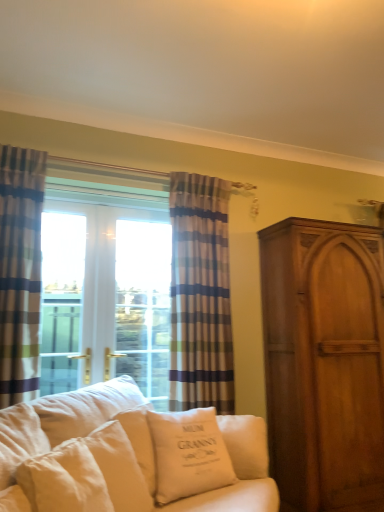
The image size is (384, 512). I want to click on striped fabric curtain at center, which is counted as the second curtain, starting from the left, so click(x=200, y=295).

The width and height of the screenshot is (384, 512). Find the location of `matte wood cabinet at right`. matte wood cabinet at right is located at coordinates (324, 362).

This screenshot has height=512, width=384. Describe the element at coordinates (324, 362) in the screenshot. I see `matte wood cabinet at right` at that location.

The image size is (384, 512). What do you see at coordinates (119, 467) in the screenshot? I see `white cotton pillow at center, placed as the second pillow when sorted from right to left` at bounding box center [119, 467].

This screenshot has height=512, width=384. I want to click on striped fabric curtain at left, positioned as the 1th curtain in left-to-right order, so click(x=20, y=271).

This screenshot has height=512, width=384. Identify the location of striped fabric curtain at center, the 1th curtain in the back-to-front sequence. pyautogui.click(x=200, y=295).

Considering the relative positions of white cotton cushion at center, arranged as the first pillow when viewed from the right, and white cotton pillow at center, marked as the 1th pillow in a left-to-right arrangement, in the image provided, is white cotton cushion at center, arranged as the first pillow when viewed from the right, to the left or to the right of white cotton pillow at center, marked as the 1th pillow in a left-to-right arrangement,?

Clearly, white cotton cushion at center, arranged as the first pillow when viewed from the right, is on the right of white cotton pillow at center, marked as the 1th pillow in a left-to-right arrangement, in the image.

What's the angular difference between white cotton cushion at center, acting as the 2th pillow starting from the left, and white cotton pillow at center, marked as the 1th pillow in a left-to-right arrangement,'s facing directions?

They differ by 26.2 degrees in their facing directions.

Which is in front, white cotton cushion at center, arranged as the first pillow when viewed from the right, or white cotton pillow at center, marked as the 1th pillow in a left-to-right arrangement?

white cotton pillow at center, marked as the 1th pillow in a left-to-right arrangement, is in front.

Considering the sizes of objects white cotton cushion at center, arranged as the first pillow when viewed from the right, and white cotton pillow at center, placed as the second pillow when sorted from right to left, in the image provided, who is taller, white cotton cushion at center, arranged as the first pillow when viewed from the right, or white cotton pillow at center, placed as the second pillow when sorted from right to left,?

With more height is white cotton cushion at center, arranged as the first pillow when viewed from the right.

In the scene shown: Which point is more forward, (245, 469) or (232, 393)?

The point (245, 469) is closer to the camera.

Which is more to the left, white fabric couch at lower left or striped fabric curtain at center, the first curtain positioned from the right?

Positioned to the left is white fabric couch at lower left.

Is white fabric couch at lower left next to striped fabric curtain at center, which is counted as the second curtain, starting from the left?

No.

In the scene shown: Considering the relative sizes of white fabric couch at lower left and striped fabric curtain at center, the first curtain positioned from the right, in the image provided, is white fabric couch at lower left taller than striped fabric curtain at center, the first curtain positioned from the right,?

Incorrect, the height of white fabric couch at lower left is not larger of that of striped fabric curtain at center, the first curtain positioned from the right.

Considering the relative sizes of striped fabric curtain at center, the 1th curtain in the back-to-front sequence, and striped fabric curtain at left, marked as the first curtain in a front-to-back arrangement, in the image provided, is striped fabric curtain at center, the 1th curtain in the back-to-front sequence, thinner than striped fabric curtain at left, marked as the first curtain in a front-to-back arrangement,?

Yes.

Could you tell me if striped fabric curtain at center, the first curtain positioned from the right, is turned towards striped fabric curtain at left, placed as the 2th curtain when sorted from back to front?

No, striped fabric curtain at center, the first curtain positioned from the right, is not turned towards striped fabric curtain at left, placed as the 2th curtain when sorted from back to front.

Measure the distance between striped fabric curtain at center, the 1th curtain in the back-to-front sequence, and striped fabric curtain at left, marked as the first curtain in a front-to-back arrangement.

A distance of 91.82 centimeters exists between striped fabric curtain at center, the 1th curtain in the back-to-front sequence, and striped fabric curtain at left, marked as the first curtain in a front-to-back arrangement.

From the picture: Between striped fabric curtain at center, which is counted as the second curtain, starting from the left, and striped fabric curtain at left, marked as the first curtain in a front-to-back arrangement, which one has larger size?

With larger size is striped fabric curtain at center, which is counted as the second curtain, starting from the left.

Considering the sizes of objects white fabric couch at lower left and white cotton pillow at center, placed as the second pillow when sorted from right to left, in the image provided, who is thinner, white fabric couch at lower left or white cotton pillow at center, placed as the second pillow when sorted from right to left,?

white cotton pillow at center, placed as the second pillow when sorted from right to left.

Locate an element on the screen. pillow that is the 1st one when counting downward from the white fabric couch at lower left (from the image's perspective) is located at coordinates (119, 467).

Is white fabric couch at lower left shorter than white cotton pillow at center, marked as the 1th pillow in a left-to-right arrangement?

Incorrect, the height of white fabric couch at lower left does not fall short of that of white cotton pillow at center, marked as the 1th pillow in a left-to-right arrangement.

Is white cotton cushion at center, arranged as the first pillow when viewed from the right, oriented away from white fabric couch at lower left?

Yes, white cotton cushion at center, arranged as the first pillow when viewed from the right, is positioned with its back facing white fabric couch at lower left.

From the image's perspective, which is above, white cotton cushion at center, acting as the 2th pillow starting from the left, or white fabric couch at lower left?

From the image's view, white fabric couch at lower left is above.

Is white cotton cushion at center, arranged as the first pillow when viewed from the right, next to white fabric couch at lower left and touching it?

No, white cotton cushion at center, arranged as the first pillow when viewed from the right, is not with white fabric couch at lower left.

From a real-world perspective, which is physically below, white cotton cushion at center, arranged as the first pillow when viewed from the right, or white fabric couch at lower left?

In real-world perspective, white fabric couch at lower left is lower.

In the image, is matte wood cabinet at right positioned in front of or behind white cotton pillow at center, placed as the second pillow when sorted from right to left?

Clearly, matte wood cabinet at right is behind white cotton pillow at center, placed as the second pillow when sorted from right to left.

How many degrees apart are the facing directions of matte wood cabinet at right and white cotton pillow at center, marked as the 1th pillow in a left-to-right arrangement?

The angle between the facing direction of matte wood cabinet at right and the facing direction of white cotton pillow at center, marked as the 1th pillow in a left-to-right arrangement, is 32.8 degrees.

Is white cotton pillow at center, marked as the 1th pillow in a left-to-right arrangement, located within matte wood cabinet at right?

Definitely not — white cotton pillow at center, marked as the 1th pillow in a left-to-right arrangement, is not inside matte wood cabinet at right.

Would you say matte wood cabinet at right is to the left or to the right of white cotton pillow at center, placed as the second pillow when sorted from right to left, in the picture?

Clearly, matte wood cabinet at right is on the right of white cotton pillow at center, placed as the second pillow when sorted from right to left, in the image.

Based on their sizes in the image, would you say matte wood cabinet at right is bigger or smaller than striped fabric curtain at left, placed as the 2th curtain when sorted from back to front?

In the image, matte wood cabinet at right appears to be larger than striped fabric curtain at left, placed as the 2th curtain when sorted from back to front.

Locate an element on the screen. This screenshot has height=512, width=384. the 2nd curtain counting from the left side of the matte wood cabinet at right is located at coordinates (20, 271).

Is matte wood cabinet at right in front of or behind striped fabric curtain at left, placed as the 2th curtain when sorted from back to front, in the image?

Visually, matte wood cabinet at right is located behind striped fabric curtain at left, placed as the 2th curtain when sorted from back to front.

Which is correct: matte wood cabinet at right is inside striped fabric curtain at left, placed as the 2th curtain when sorted from back to front, or outside of it?

matte wood cabinet at right is outside striped fabric curtain at left, placed as the 2th curtain when sorted from back to front.

Locate an element on the screen. Image resolution: width=384 pixels, height=512 pixels. pillow on the right of the white cotton pillow at center, marked as the 1th pillow in a left-to-right arrangement is located at coordinates (188, 454).

Find the location of a particular element. studio couch lying in front of the striped fabric curtain at center, which is counted as the second curtain, starting from the left is located at coordinates (129, 456).

Estimate the real-world distances between objects in this image. Which object is further from white fabric couch at lower left, matte wood cabinet at right or striped fabric curtain at center, which is counted as the second curtain, starting from the left?

matte wood cabinet at right is positioned further to the anchor white fabric couch at lower left.

From the image, which object appears to be farther from white fabric couch at lower left, white cotton cushion at center, arranged as the first pillow when viewed from the right, or matte wood cabinet at right?

The object further to white fabric couch at lower left is matte wood cabinet at right.

Estimate the real-world distances between objects in this image. Which object is closer to white cotton cushion at center, arranged as the first pillow when viewed from the right, striped fabric curtain at left, positioned as the 1th curtain in left-to-right order, or striped fabric curtain at center, which is counted as the second curtain, starting from the left?

striped fabric curtain at center, which is counted as the second curtain, starting from the left, lies closer to white cotton cushion at center, arranged as the first pillow when viewed from the right, than the other object.

Looking at this image, based on their spatial positions, is striped fabric curtain at center, which is counted as the second curtain, starting from the left, or striped fabric curtain at left, marked as the first curtain in a front-to-back arrangement, closer to white fabric couch at lower left?

Based on the image, striped fabric curtain at center, which is counted as the second curtain, starting from the left, appears to be nearer to white fabric couch at lower left.

When comparing their distances from white fabric couch at lower left, does white cotton pillow at center, marked as the 1th pillow in a left-to-right arrangement, or white cotton cushion at center, acting as the 2th pillow starting from the left, seem further?

Among the two, white cotton pillow at center, marked as the 1th pillow in a left-to-right arrangement, is located further to white fabric couch at lower left.

Considering their positions, is white cotton pillow at center, placed as the second pillow when sorted from right to left, positioned closer to striped fabric curtain at center, the 1th curtain in the back-to-front sequence, than white cotton cushion at center, arranged as the first pillow when viewed from the right?

The object closer to striped fabric curtain at center, the 1th curtain in the back-to-front sequence, is white cotton cushion at center, arranged as the first pillow when viewed from the right.

Looking at this image, based on their spatial positions, is white cotton cushion at center, acting as the 2th pillow starting from the left, or white cotton pillow at center, marked as the 1th pillow in a left-to-right arrangement, further from striped fabric curtain at left, positioned as the 1th curtain in left-to-right order?

white cotton cushion at center, acting as the 2th pillow starting from the left, is further to striped fabric curtain at left, positioned as the 1th curtain in left-to-right order.

When comparing their distances from striped fabric curtain at center, the 1th curtain in the back-to-front sequence, does striped fabric curtain at left, placed as the 2th curtain when sorted from back to front, or white fabric couch at lower left seem closer?

white fabric couch at lower left.

This screenshot has height=512, width=384. I want to click on pillow between striped fabric curtain at left, positioned as the 1th curtain in left-to-right order, and white cotton cushion at center, arranged as the first pillow when viewed from the right, from top to bottom, so click(x=119, y=467).

At what (x,y) coordinates should I click in order to perform the action: click on curtain located between white fabric couch at lower left and matte wood cabinet at right in the depth direction. Please return your answer as a coordinate pair (x, y). This screenshot has height=512, width=384. Looking at the image, I should click on (20, 271).

Where is `curtain between striped fabric curtain at left, marked as the first curtain in a front-to-back arrangement, and matte wood cabinet at right`? curtain between striped fabric curtain at left, marked as the first curtain in a front-to-back arrangement, and matte wood cabinet at right is located at coordinates (200, 295).

You are a GUI agent. You are given a task and a screenshot of the screen. Output one action in this format:
    pyautogui.click(x=<x>, y=<y>)
    Task: Click on the pillow between striped fabric curtain at center, which is the second curtain from front to back, and white cotton cushion at center, acting as the 2th pillow starting from the left, in the up-down direction
    This screenshot has height=512, width=384.
    Given the screenshot: What is the action you would take?
    pyautogui.click(x=119, y=467)